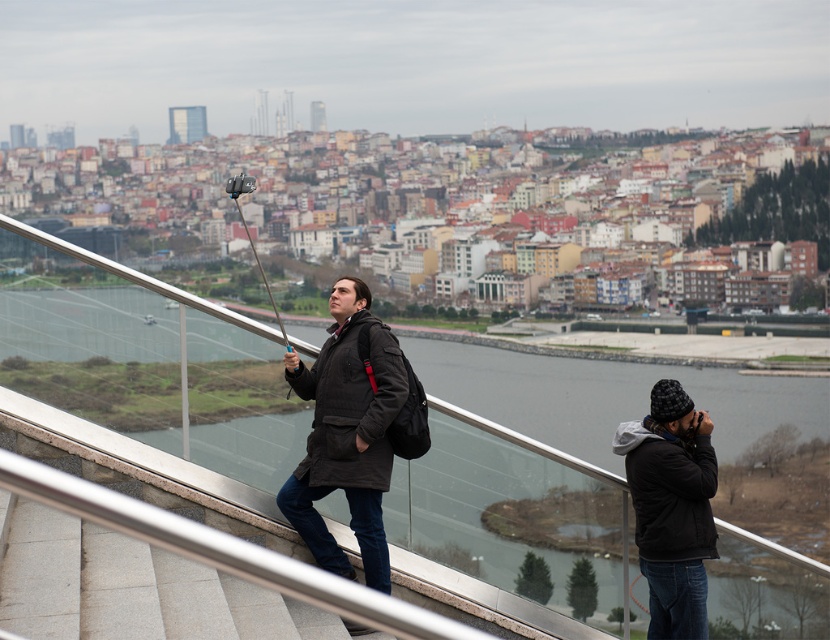
Is point (802, 609) positioned behind point (367, 460)?

That is True.

Is transparent glass water at center closer to camera compared to brown matte jacket at center?

Yes, transparent glass water at center is closer to the viewer.

Does point (597, 490) come in front of point (330, 376)?

No, it is behind (330, 376).

The image size is (830, 640). I want to click on transparent glass water at center, so click(150, 365).

This screenshot has width=830, height=640. Identify the location of brown matte jacket at center. (350, 406).

Does brown matte jacket at center appear on the left side of black quilted jacket at lower right?

Yes, brown matte jacket at center is to the left of black quilted jacket at lower right.

Describe the element at coordinates (350, 406) in the screenshot. I see `brown matte jacket at center` at that location.

Where is `brown matte jacket at center`? Image resolution: width=830 pixels, height=640 pixels. brown matte jacket at center is located at coordinates (350, 406).

Does dark brown leather jacket at center have a greater width compared to black quilted jacket at lower right?

Indeed, dark brown leather jacket at center has a greater width compared to black quilted jacket at lower right.

Does dark brown leather jacket at center appear on the left side of black quilted jacket at lower right?

Correct, you'll find dark brown leather jacket at center to the left of black quilted jacket at lower right.

Where is `dark brown leather jacket at center`? This screenshot has width=830, height=640. dark brown leather jacket at center is located at coordinates (345, 433).

Find the location of `dark brown leather jacket at center`. dark brown leather jacket at center is located at coordinates (345, 433).